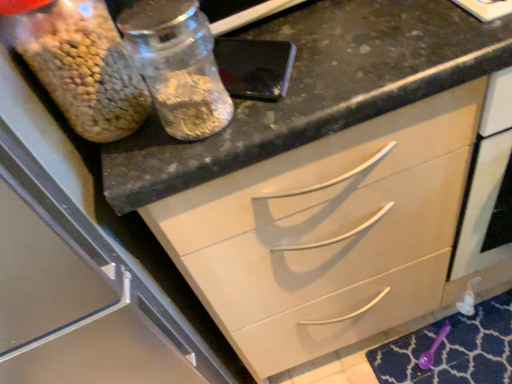
Question: Is translucent glass jar at upper left at the left side of black granite countertop at upper center?

Choices:
 (A) yes
 (B) no

Answer: (A)

Question: Does translucent glass jar at upper left have a larger size compared to black granite countertop at upper center?

Choices:
 (A) no
 (B) yes

Answer: (A)

Question: Is translucent glass jar at upper left thinner than black granite countertop at upper center?

Choices:
 (A) yes
 (B) no

Answer: (A)

Question: Are translucent glass jar at upper left and black granite countertop at upper center located far from each other?

Choices:
 (A) no
 (B) yes

Answer: (A)

Question: Is translucent glass jar at upper left located outside black granite countertop at upper center?

Choices:
 (A) yes
 (B) no

Answer: (A)

Question: In terms of size, does translucent glass jar at upper left appear bigger or smaller than purple plastic spoon at lower right?

Choices:
 (A) big
 (B) small

Answer: (A)

Question: From their relative heights in the image, would you say translucent glass jar at upper left is taller or shorter than purple plastic spoon at lower right?

Choices:
 (A) short
 (B) tall

Answer: (B)

Question: Is translucent glass jar at upper left in front of or behind purple plastic spoon at lower right in the image?

Choices:
 (A) behind
 (B) front

Answer: (B)

Question: Is translucent glass jar at upper left inside the boundaries of purple plastic spoon at lower right, or outside?

Choices:
 (A) outside
 (B) inside

Answer: (A)

Question: Is point (88, 59) positioned closer to the camera than point (200, 11)?

Choices:
 (A) closer
 (B) farther

Answer: (A)

Question: From the image's perspective, is translucent glass jar at upper left located above or below transparent glass jar at upper left?

Choices:
 (A) above
 (B) below

Answer: (A)

Question: Considering the positions of translucent glass jar at upper left and transparent glass jar at upper left in the image, is translucent glass jar at upper left taller or shorter than transparent glass jar at upper left?

Choices:
 (A) short
 (B) tall

Answer: (B)

Question: In the image, is translucent glass jar at upper left positioned in front of or behind transparent glass jar at upper left?

Choices:
 (A) behind
 (B) front

Answer: (A)

Question: Does point coord(190,129) appear closer or farther from the camera than point coord(67,4)?

Choices:
 (A) closer
 (B) farther

Answer: (B)

Question: Based on their positions, is transparent glass jar at upper left located to the left or right of translucent glass jar at upper left?

Choices:
 (A) left
 (B) right

Answer: (B)